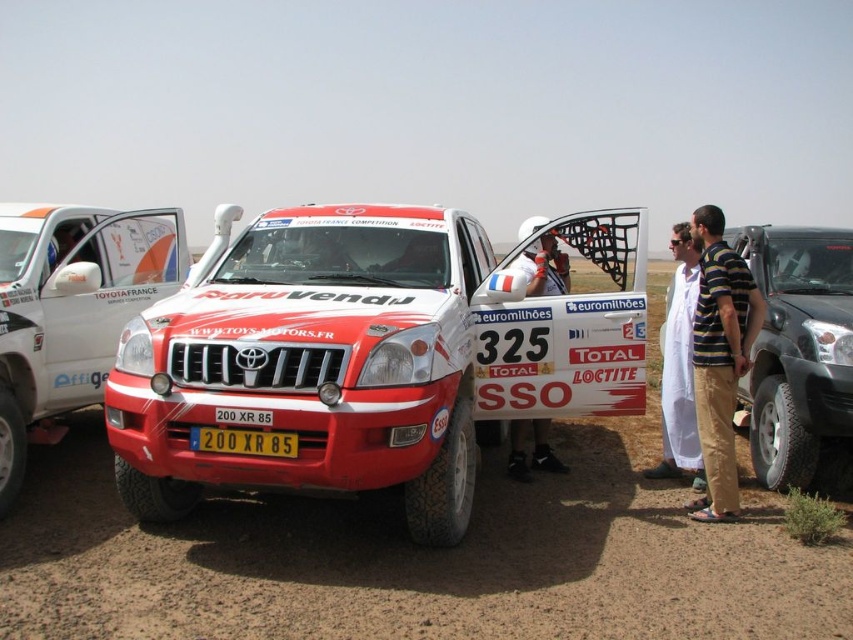
Is point (48, 387) more distant than point (711, 268)?

Yes, point (48, 387) is farther from viewer.

Is point (146, 243) less distant than point (703, 333)?

No, (146, 243) is further to viewer.

Between point (44, 428) and point (712, 266), which one is positioned in front?

Positioned in front is point (712, 266).

Where is `matte red suv at center`? matte red suv at center is located at coordinates (70, 310).

Who is positioned more to the left, striped cotton shirt at right or yellow metallic license plate at center?

yellow metallic license plate at center is more to the left.

Can you confirm if striped cotton shirt at right is positioned above yellow metallic license plate at center?

Yes, striped cotton shirt at right is above yellow metallic license plate at center.

Which is in front, point (743, 269) or point (210, 435)?

Point (210, 435) is more forward.

You are a GUI agent. You are given a task and a screenshot of the screen. Output one action in this format:
    pyautogui.click(x=<x>, y=<y>)
    Task: Click on the striped cotton shirt at right
    The image size is (853, 640).
    Given the screenshot: What is the action you would take?
    pyautogui.click(x=718, y=358)

Does point (392, 340) come closer to viewer compared to point (697, 280)?

Yes, it is in front of point (697, 280).

Can you confirm if matte white suv at center is wider than white cloth at right?

Yes.

Between point (463, 216) and point (666, 358), which one is positioned behind?

Positioned behind is point (463, 216).

The image size is (853, 640). What are the coordinates of `matte white suv at center` in the screenshot? It's located at (368, 355).